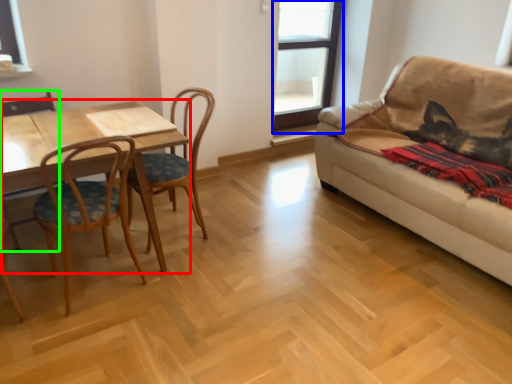
Question: Based on their relative distances, which object is farther from table (highlighted by a red box)? Choose from window (highlighted by a blue box) and armchair (highlighted by a green box).

Choices:
 (A) window
 (B) armchair

Answer: (A)